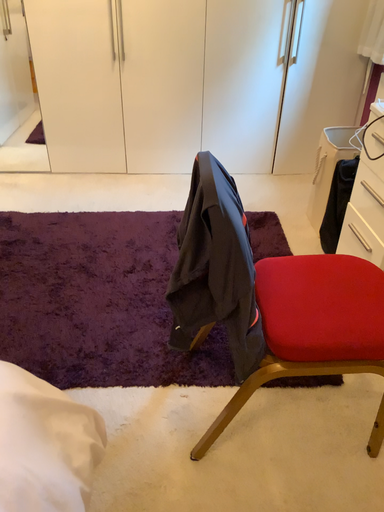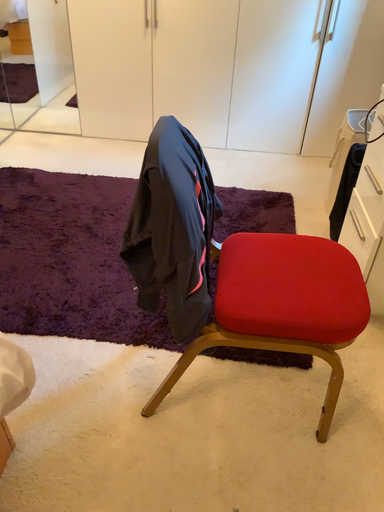
Question: Which way did the camera rotate in the video?

Choices:
 (A) rotated right
 (B) rotated left

Answer: (B)